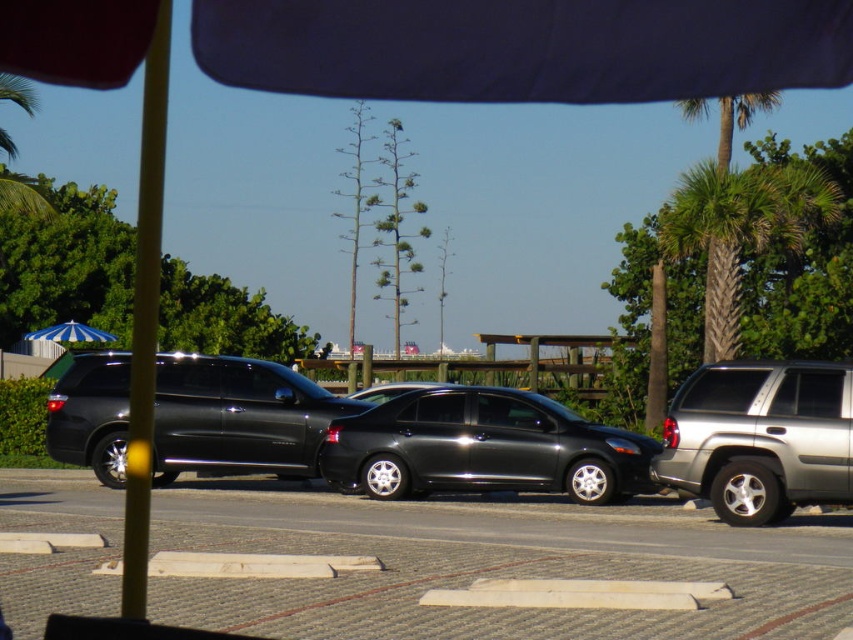
Can you confirm if gray textured asphalt at center is positioned to the left of glossy black sedan at center?

Yes, gray textured asphalt at center is to the left of glossy black sedan at center.

Looking at this image, who is taller, gray textured asphalt at center or glossy black sedan at center?

glossy black sedan at center is taller.

This screenshot has height=640, width=853. I want to click on gray textured asphalt at center, so click(494, 566).

Does gray textured asphalt at center have a lesser width compared to blue striped umbrella at left?

No.

Can you confirm if gray textured asphalt at center is taller than blue striped umbrella at left?

In fact, gray textured asphalt at center may be shorter than blue striped umbrella at left.

Is point (254, 589) closer to camera compared to point (64, 326)?

Yes, point (254, 589) is in front of point (64, 326).

I want to click on gray textured asphalt at center, so click(494, 566).

Who is more forward, [496,392] or [703,99]?

Point [496,392]

Is glossy black sedan at center bigger than green textured palm tree at right?

Incorrect, glossy black sedan at center is not larger than green textured palm tree at right.

Does point (346, 481) lie behind point (764, 106)?

No, it is not.

Where is `glossy black sedan at center`? This screenshot has height=640, width=853. glossy black sedan at center is located at coordinates (483, 448).